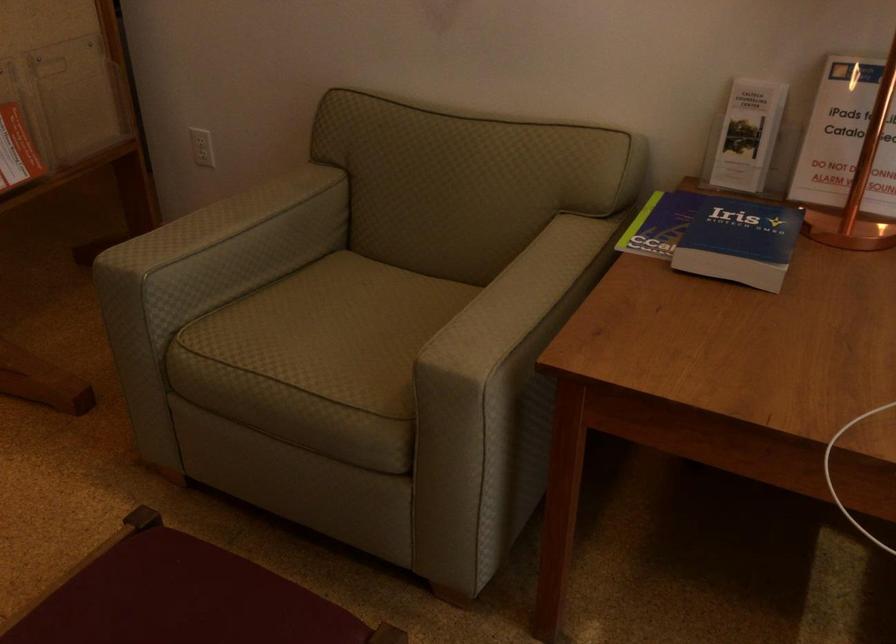
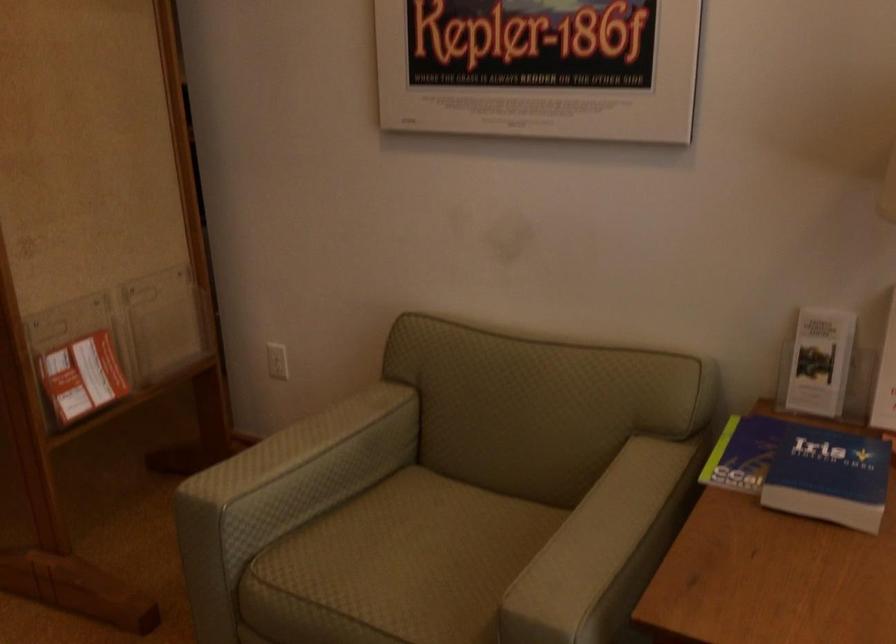
In the second image, find the point that corresponds to point 527,281 in the first image.

(607, 520)